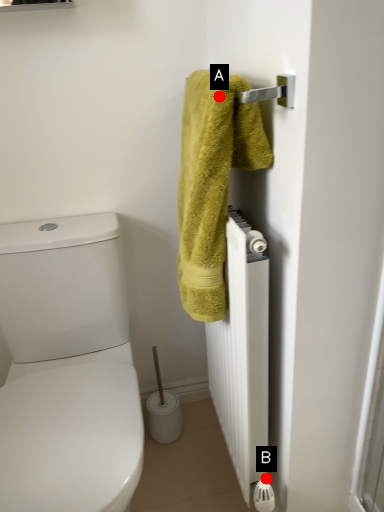
Question: Two points are circled on the image, labeled by A and B beside each circle. Which point is closer to the camera taking this photo?

Choices:
 (A) A is closer
 (B) B is closer

Answer: (A)